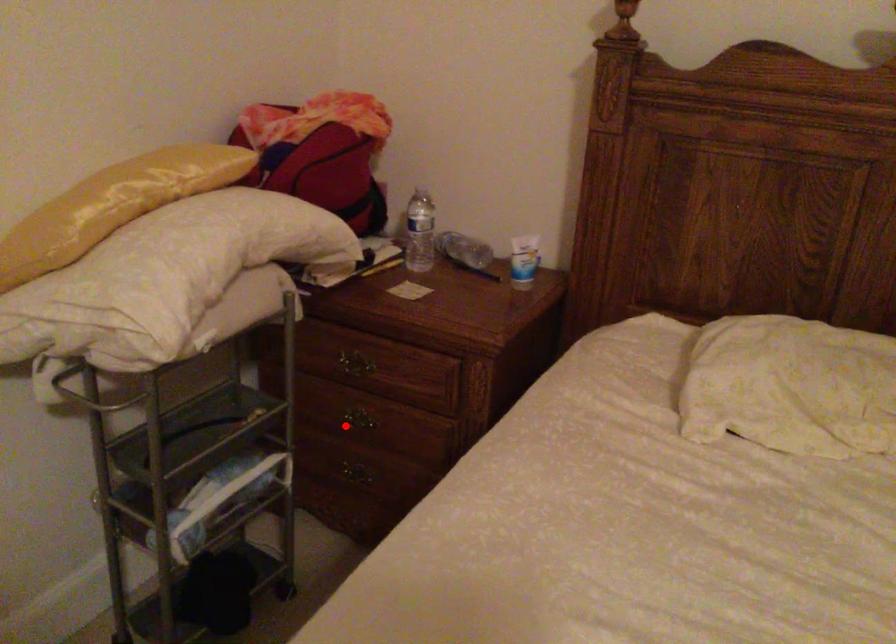
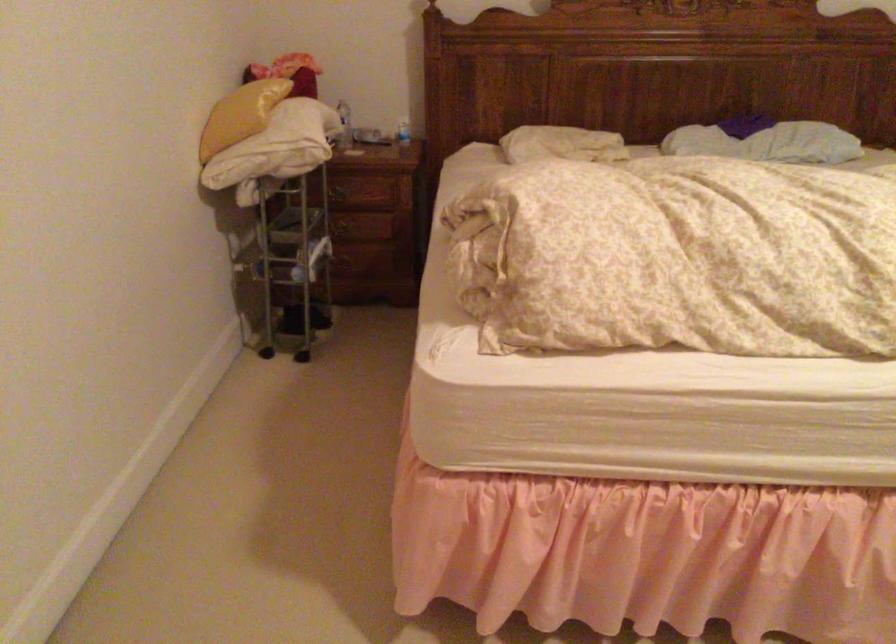
Locate, in the second image, the point that corresponds to the highlighted location in the first image.

(342, 230)